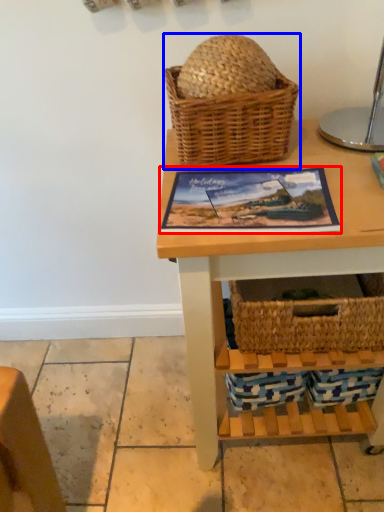
Question: Which of the following is the closest to the observer, picture frame (highlighted by a red box) or picnic basket (highlighted by a blue box)?

Choices:
 (A) picture frame
 (B) picnic basket

Answer: (A)